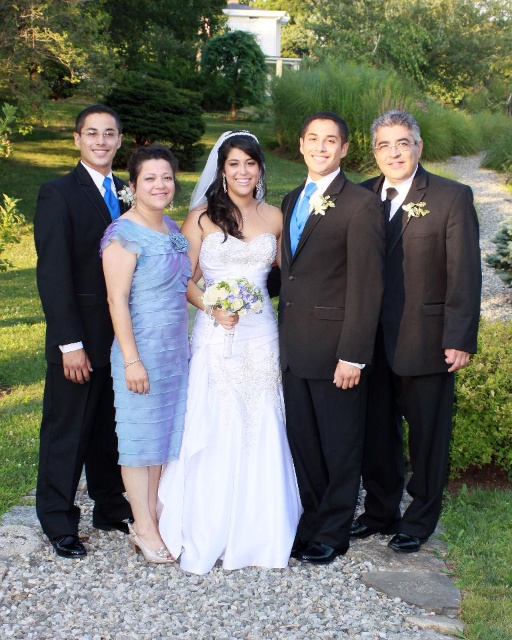
You are a photographer trying to frame the wedding party. You want to ensure the black satin suit at right is centered in your shot. What coordinates should you aim for?

The black satin suit at right is located at coordinates point (416,332), so you should aim your camera to center the shot at those coordinates to include it properly.

You are a photographer standing 10 feet away from the black satin suit at right and the light blue chiffon dress at center. You want to capture a photo where both subjects are in focus. If your camera has a depth of field that can cover 6 feet, will you be able to achieve this?

The black satin suit at right is 5.53 feet away from the light blue chiffon dress at center. Since the distance between them is less than the camera lens depth of field of 6 feet, both subjects will be in focus.